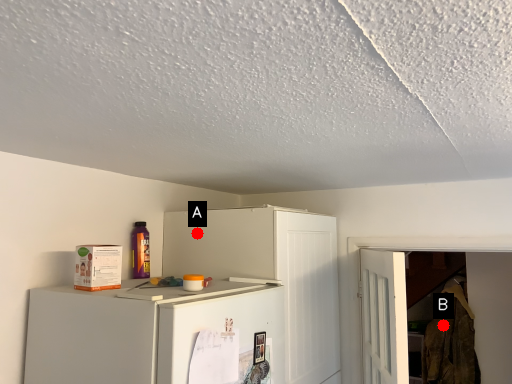
Question: Two points are circled on the image, labeled by A and B beside each circle. Which of the following is the closest to the observer?

Choices:
 (A) A is closer
 (B) B is closer

Answer: (A)